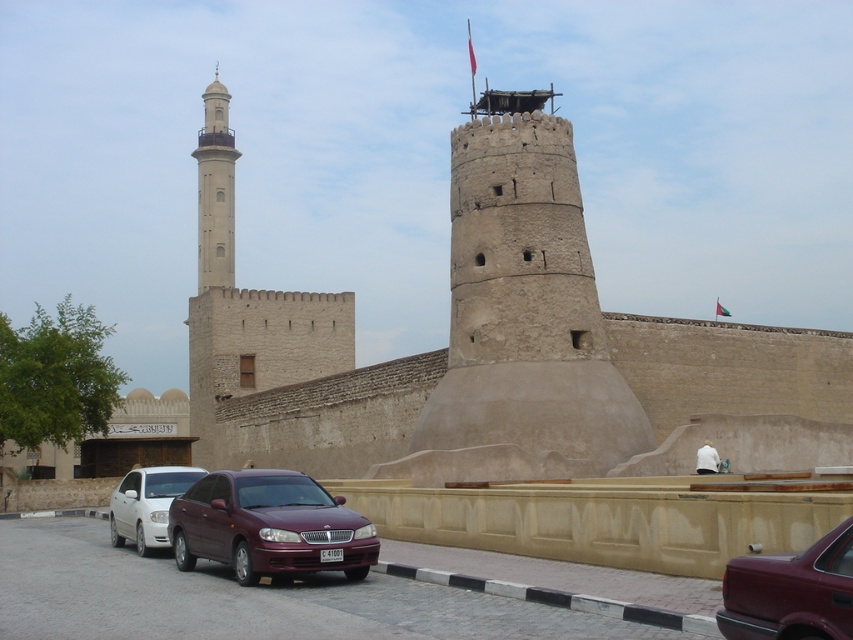
Question: Estimate the real-world distances between objects in this image. Which object is closer to the light beige stone minaret at upper left?

Choices:
 (A) white matte sedan at center
 (B) maroon metallic sedan at center
 (C) maroon matte car at center

Answer: (A)

Question: Which of these objects is positioned farthest from the light beige stone minaret at upper left?

Choices:
 (A) brown stone fort at center
 (B) maroon matte car at center

Answer: (B)

Question: Which point is farther to the camera?

Choices:
 (A) (248, 566)
 (B) (173, 486)
 (C) (444, 435)

Answer: (C)

Question: Is light beige stone minaret at upper left above white matte sedan at center?

Choices:
 (A) yes
 (B) no

Answer: (A)

Question: Does brown stone fort at center appear over light beige stone minaret at upper left?

Choices:
 (A) no
 (B) yes

Answer: (A)

Question: Is brown stone fort at center in front of light beige stone minaret at upper left?

Choices:
 (A) no
 (B) yes

Answer: (B)